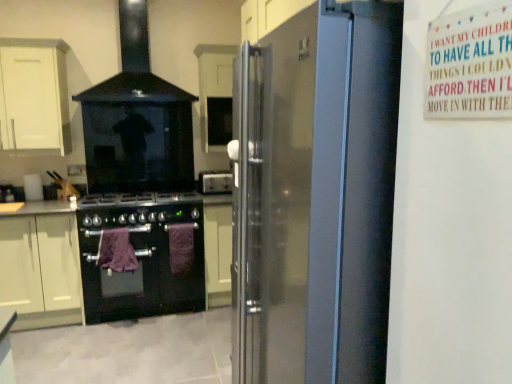
Describe the element at coordinates (34, 95) in the screenshot. I see `white matte cabinet at upper left, arranged as the second cabinetry when viewed from the left` at that location.

The image size is (512, 384). In order to click on satin silver toaster at center in this screenshot , I will do `click(215, 182)`.

What do you see at coordinates (116, 251) in the screenshot?
I see `purple towel at center, arranged as the 1th blanket when viewed from the left` at bounding box center [116, 251].

Locate an element on the screen. white matte cabinet at center, arranged as the 3th cabinetry when viewed from the left is located at coordinates (215, 94).

Between purple towel at center, the 1th blanket in the right-to-left sequence, and purple towel at center, arranged as the 1th blanket when viewed from the left, which one has larger width?

purple towel at center, arranged as the 1th blanket when viewed from the left.

Is purple towel at center, the second blanket viewed from the left, bigger or smaller than purple towel at center, which is the 2th blanket in right-to-left order?

purple towel at center, the second blanket viewed from the left, is smaller than purple towel at center, which is the 2th blanket in right-to-left order.

In the scene shown: Is purple towel at center, arranged as the 1th blanket when viewed from the left, at the back of purple towel at center, the second blanket viewed from the left?

That's not correct — purple towel at center, the second blanket viewed from the left, is not looking away from purple towel at center, arranged as the 1th blanket when viewed from the left.

Does purple towel at center, the second blanket viewed from the left, come in front of purple towel at center, which is the 2th blanket in right-to-left order?

No, purple towel at center, the second blanket viewed from the left, is further to the viewer.

Is black matte gas stove at center not within purple towel at center, the second blanket viewed from the left?

That's correct, black matte gas stove at center is outside of purple towel at center, the second blanket viewed from the left.

Consider the image. Is black matte gas stove at center taller or shorter than purple towel at center, the 1th blanket in the right-to-left sequence?

black matte gas stove at center is shorter than purple towel at center, the 1th blanket in the right-to-left sequence.

From a real-world perspective, which is physically below, black matte gas stove at center or purple towel at center, the second blanket viewed from the left?

In real-world perspective, purple towel at center, the second blanket viewed from the left, is lower.

Between point (117, 196) and point (184, 223), which one is positioned in front?

The point (184, 223) is more forward.

Are purple towel at center, the 1th blanket in the right-to-left sequence, and white wooden sign at upper right beside each other?

purple towel at center, the 1th blanket in the right-to-left sequence, and white wooden sign at upper right are not in contact.

Can we say purple towel at center, the second blanket viewed from the left, lies outside white wooden sign at upper right?

That's correct, purple towel at center, the second blanket viewed from the left, is outside of white wooden sign at upper right.

Considering the relative positions of purple towel at center, the 1th blanket in the right-to-left sequence, and white wooden sign at upper right in the image provided, is purple towel at center, the 1th blanket in the right-to-left sequence, to the left or to the right of white wooden sign at upper right?

purple towel at center, the 1th blanket in the right-to-left sequence, is positioned on white wooden sign at upper right's left side.

Is purple towel at center, the second blanket viewed from the left, taller than white wooden sign at upper right?

Yes, purple towel at center, the second blanket viewed from the left, is taller than white wooden sign at upper right.

Can you tell me how much white matte cabinet at center, which is the first cabinetry from right to left, and satin black refrigerator at right differ in facing direction?

The angle between the facing direction of white matte cabinet at center, which is the first cabinetry from right to left, and the facing direction of satin black refrigerator at right is 90.2 degrees.

From a real-world perspective, is white matte cabinet at center, which is the first cabinetry from right to left, physically below satin black refrigerator at right?

No, from a real-world perspective, white matte cabinet at center, which is the first cabinetry from right to left, is not beneath satin black refrigerator at right.

Is white matte cabinet at center, which is the first cabinetry from right to left, positioned far away from satin black refrigerator at right?

Yes, white matte cabinet at center, which is the first cabinetry from right to left, is far from satin black refrigerator at right.

Which object is closer to the camera, white matte cabinet at center, arranged as the 3th cabinetry when viewed from the left, or satin black refrigerator at right?

satin black refrigerator at right is closer to the camera.

Is point (18, 90) more distant than point (170, 228)?

No.

Which object is closer to the camera, white matte cabinet at upper left, which ranks as the 2th cabinetry in right-to-left order, or purple towel at center, the 1th blanket in the right-to-left sequence?

white matte cabinet at upper left, which ranks as the 2th cabinetry in right-to-left order, is in front.

Considering the sizes of white matte cabinet at upper left, which ranks as the 2th cabinetry in right-to-left order, and purple towel at center, the 1th blanket in the right-to-left sequence, in the image, is white matte cabinet at upper left, which ranks as the 2th cabinetry in right-to-left order, taller or shorter than purple towel at center, the 1th blanket in the right-to-left sequence,?

white matte cabinet at upper left, which ranks as the 2th cabinetry in right-to-left order, is taller than purple towel at center, the 1th blanket in the right-to-left sequence.

From the image's perspective, relative to purple towel at center, the 1th blanket in the right-to-left sequence, is white matte cabinet at upper left, arranged as the second cabinetry when viewed from the left, above or below?

Clearly, from the image's perspective, white matte cabinet at upper left, arranged as the second cabinetry when viewed from the left, is above purple towel at center, the 1th blanket in the right-to-left sequence.

Could you measure the distance between purple towel at center, which is the 2th blanket in right-to-left order, and purple towel at center, the 1th blanket in the right-to-left sequence?

They are 14.99 inches apart.

Is purple towel at center, arranged as the 1th blanket when viewed from the left, positioned far away from purple towel at center, the second blanket viewed from the left?

No, purple towel at center, arranged as the 1th blanket when viewed from the left, is in close proximity to purple towel at center, the second blanket viewed from the left.

From the image's perspective, is purple towel at center, which is the 2th blanket in right-to-left order, located above purple towel at center, the second blanket viewed from the left?

Indeed, from the image's perspective, purple towel at center, which is the 2th blanket in right-to-left order, is shown above purple towel at center, the second blanket viewed from the left.

In terms of width, does purple towel at center, which is the 2th blanket in right-to-left order, look wider or thinner when compared to purple towel at center, the 1th blanket in the right-to-left sequence?

Clearly, purple towel at center, which is the 2th blanket in right-to-left order, has more width compared to purple towel at center, the 1th blanket in the right-to-left sequence.

What's the angular difference between white matte cabinet at upper left, arranged as the second cabinetry when viewed from the left, and black matte gas stove at center's facing directions?

The facing directions of white matte cabinet at upper left, arranged as the second cabinetry when viewed from the left, and black matte gas stove at center are 0.124 degrees apart.

Which of these two, white matte cabinet at upper left, which ranks as the 2th cabinetry in right-to-left order, or black matte gas stove at center, is bigger?

white matte cabinet at upper left, which ranks as the 2th cabinetry in right-to-left order, is bigger.

Is white matte cabinet at upper left, arranged as the second cabinetry when viewed from the left, positioned far away from black matte gas stove at center?

No.

Is white matte cabinet at upper left, arranged as the second cabinetry when viewed from the left, positioned behind black matte gas stove at center?

No, white matte cabinet at upper left, arranged as the second cabinetry when viewed from the left, is closer to the viewer.

Locate an element on the screen. The width and height of the screenshot is (512, 384). blanket in front of the purple towel at center, the 1th blanket in the right-to-left sequence is located at coordinates (116, 251).

Find the location of a particular element. The image size is (512, 384). blanket on the right of black matte gas stove at center is located at coordinates (181, 247).

Based on their spatial positions, is black glass stove at center or purple towel at center, arranged as the 1th blanket when viewed from the left, closer to black matte gas stove at center?

Among the two, black glass stove at center is located nearer to black matte gas stove at center.

Based on their spatial positions, is satin silver toaster at center or matte white cabinet at lower left, acting as the 3th cabinetry starting from the right, further from white matte cabinet at upper left, arranged as the second cabinetry when viewed from the left?

Based on the image, satin silver toaster at center appears to be further to white matte cabinet at upper left, arranged as the second cabinetry when viewed from the left.

Based on their spatial positions, is white matte cabinet at upper left, arranged as the second cabinetry when viewed from the left, or white matte cabinet at center, arranged as the 3th cabinetry when viewed from the left, further from satin silver toaster at center?

white matte cabinet at upper left, arranged as the second cabinetry when viewed from the left, is further to satin silver toaster at center.

Estimate the real-world distances between objects in this image. Which object is closer to white wooden sign at upper right, black glass stove at center or black matte gas stove at center?

black matte gas stove at center is closer to white wooden sign at upper right.

Considering their positions, is purple towel at center, the 1th blanket in the right-to-left sequence, positioned further to black glass stove at upper center than satin silver toaster at center?

The object further to black glass stove at upper center is purple towel at center, the 1th blanket in the right-to-left sequence.

Based on their spatial positions, is white wooden sign at upper right or black matte gas stove at center further from purple towel at center, the second blanket viewed from the left?

white wooden sign at upper right is positioned further to the anchor purple towel at center, the second blanket viewed from the left.

Looking at the image, which one is located closer to white matte cabinet at upper left, arranged as the second cabinetry when viewed from the left, black glass stove at upper center or black glass stove at center?

Based on the image, black glass stove at upper center appears to be nearer to white matte cabinet at upper left, arranged as the second cabinetry when viewed from the left.

In the scene shown: Estimate the real-world distances between objects in this image. Which object is closer to purple towel at center, the second blanket viewed from the left, white matte cabinet at center, which is the first cabinetry from right to left, or matte white cabinet at lower left, which ranks as the 1th cabinetry in left-to-right order?

matte white cabinet at lower left, which ranks as the 1th cabinetry in left-to-right order, is closer to purple towel at center, the second blanket viewed from the left.

Locate an element on the screen. The height and width of the screenshot is (384, 512). gas stove between black glass stove at upper center and black glass stove at center vertically is located at coordinates (139, 209).

Where is `gas stove between white matte cabinet at upper left, which ranks as the 2th cabinetry in right-to-left order, and purple towel at center, the 1th blanket in the right-to-left sequence, in the up-down direction`? This screenshot has width=512, height=384. gas stove between white matte cabinet at upper left, which ranks as the 2th cabinetry in right-to-left order, and purple towel at center, the 1th blanket in the right-to-left sequence, in the up-down direction is located at coordinates (139, 209).

Locate an element on the screen. home appliance between satin black refrigerator at right and black glass stove at center in the front-back direction is located at coordinates (137, 121).

The image size is (512, 384). I want to click on kitchen appliance situated between matte white cabinet at lower left, acting as the 3th cabinetry starting from the right, and purple towel at center, the 1th blanket in the right-to-left sequence, from left to right, so click(x=142, y=255).